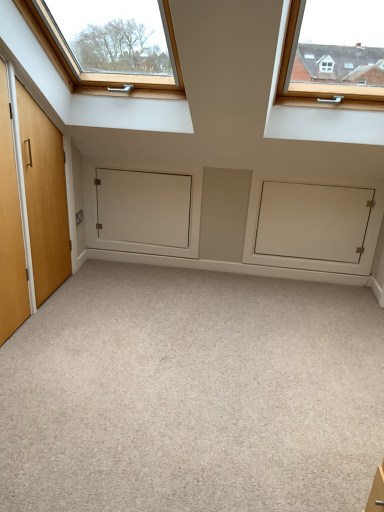
Question: Visually, is white matte cabinet at center positioned to the left or to the right of white matte door at center?

Choices:
 (A) right
 (B) left

Answer: (A)

Question: From a real-world perspective, is white matte cabinet at center physically located above or below white matte door at center?

Choices:
 (A) below
 (B) above

Answer: (A)

Question: Estimate the real-world distances between objects in this image. Which object is farther from the white matte door at center?

Choices:
 (A) carpet at center
 (B) white matte cabinet at center

Answer: (A)

Question: Based on their relative distances, which object is nearer to the carpet at center?

Choices:
 (A) white matte door at center
 (B) white matte cabinet at center

Answer: (B)